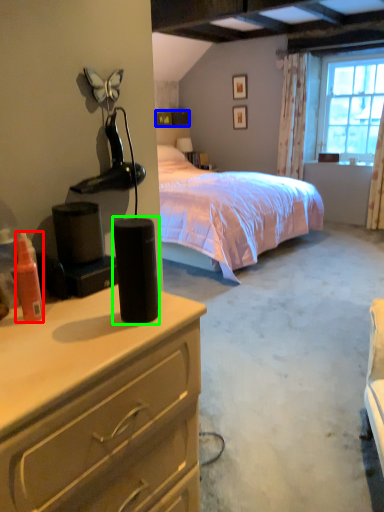
Question: Which object is positioned farthest from bottle (highlighted by a red box)? Select from box (highlighted by a blue box) and speaker (highlighted by a green box).

Choices:
 (A) box
 (B) speaker

Answer: (A)